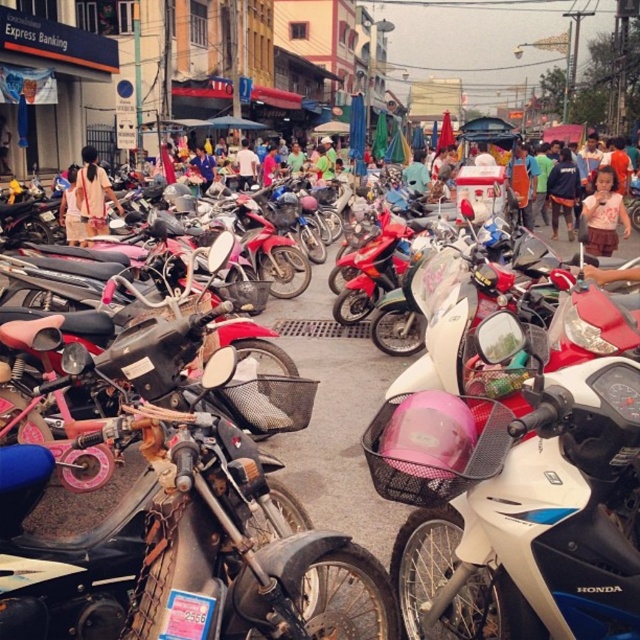
Does rusty metal motorcycle at center have a lesser width compared to white matte motorcycle at center?

No.

Can you confirm if rusty metal motorcycle at center is positioned above white matte motorcycle at center?

Yes, rusty metal motorcycle at center is above white matte motorcycle at center.

Where is `rusty metal motorcycle at center`? Image resolution: width=640 pixels, height=640 pixels. rusty metal motorcycle at center is located at coordinates (204, 557).

Between pink fabric dress at right and light blue shirt at center, which one appears on the right side from the viewer's perspective?

Positioned to the right is pink fabric dress at right.

Between point (592, 200) and point (236, 166), which one is positioned behind?

Point (236, 166)

Image resolution: width=640 pixels, height=640 pixels. I want to click on pink fabric dress at right, so click(604, 212).

Is white matte motorcycle at center below dark blue shirt at center?

Indeed, white matte motorcycle at center is positioned under dark blue shirt at center.

Who is positioned more to the right, white matte motorcycle at center or dark blue shirt at center?

From the viewer's perspective, dark blue shirt at center appears more on the right side.

Locate an element on the screen. white matte motorcycle at center is located at coordinates (534, 525).